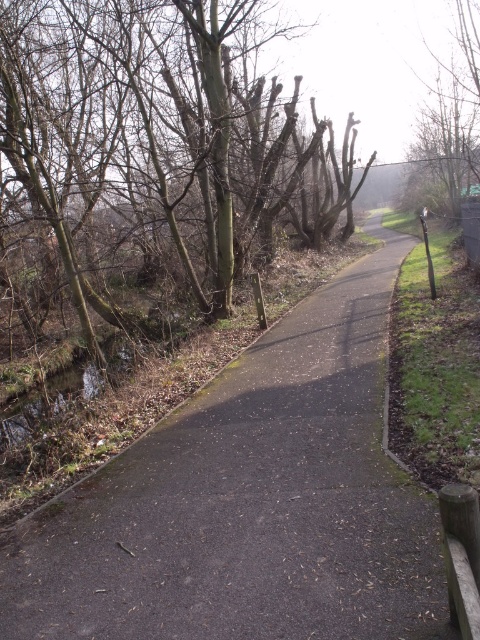
Is point (32, 164) behind point (444, 163)?

No.

Between smooth bark tree at upper center and bare wood tree at upper right, which one has more height?

Standing taller between the two is smooth bark tree at upper center.

Who is more forward, (262, 168) or (470, 168)?

Point (262, 168) is more forward.

The width and height of the screenshot is (480, 640). Find the location of `smooth bark tree at upper center`. smooth bark tree at upper center is located at coordinates (156, 150).

Is dark asphalt path at center above bare wood tree at upper right?

No, dark asphalt path at center is not above bare wood tree at upper right.

Who is higher up, dark asphalt path at center or bare wood tree at upper right?

Positioned higher is bare wood tree at upper right.

This screenshot has height=640, width=480. What do you see at coordinates (251, 502) in the screenshot?
I see `dark asphalt path at center` at bounding box center [251, 502].

In order to click on dark asphalt path at center in this screenshot , I will do `click(251, 502)`.

Which of these two, dark asphalt path at center or smooth bark tree at upper center, stands taller?

With more height is smooth bark tree at upper center.

Consider the image. Does dark asphalt path at center appear over smooth bark tree at upper center?

No.

Does point (354, 595) come farther from viewer compared to point (232, 221)?

No, it is not.

Where is `dark asphalt path at center`? Image resolution: width=480 pixels, height=640 pixels. dark asphalt path at center is located at coordinates (251, 502).